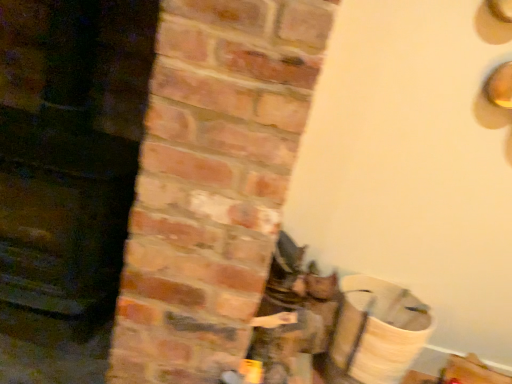
The image size is (512, 384). Describe the element at coordinates (68, 157) in the screenshot. I see `dark brick fireplace at left` at that location.

Locate an element on the screen. dark brick fireplace at left is located at coordinates (68, 157).

This screenshot has width=512, height=384. I want to click on dark brick fireplace at left, so click(x=68, y=157).